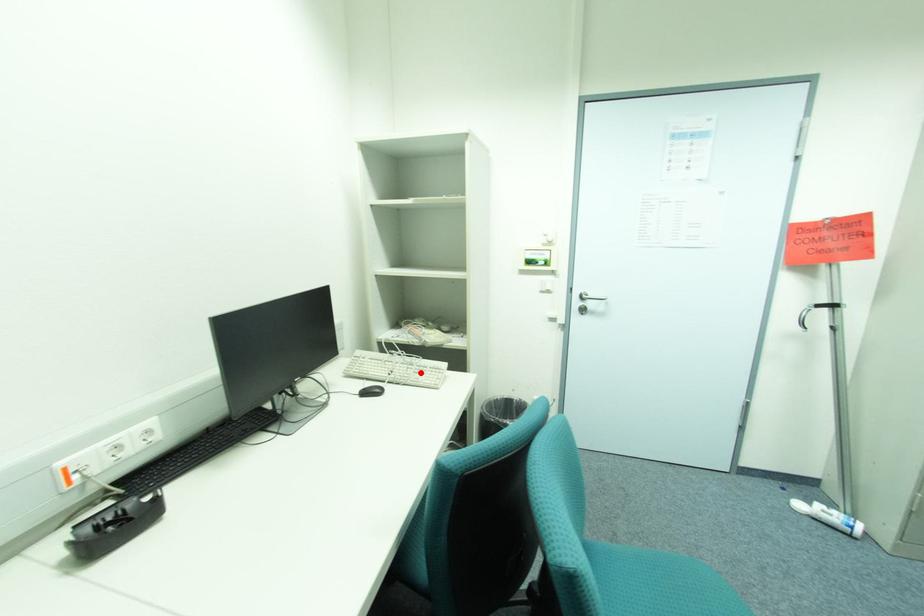
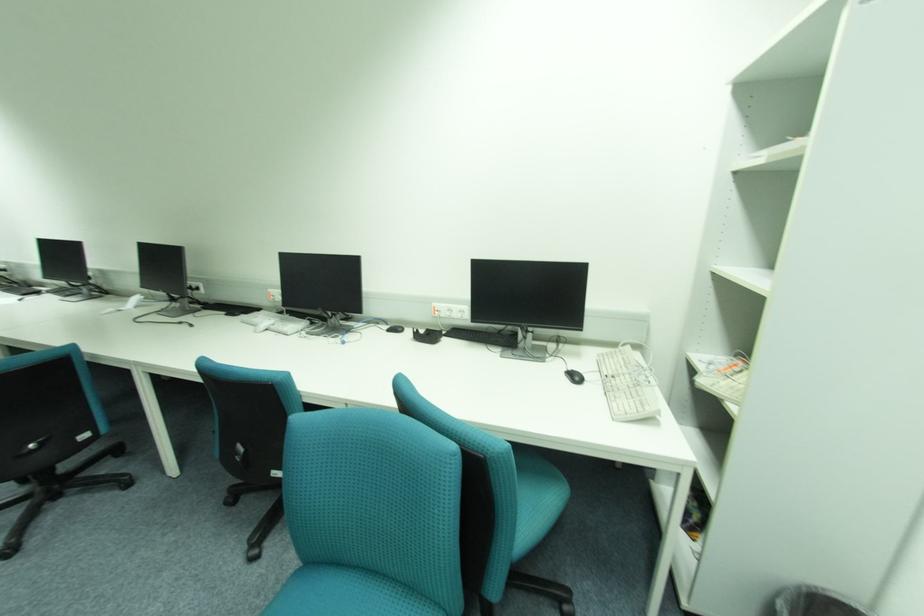
Find the pixel in the second image that matches the highlighted location in the first image.

(631, 392)